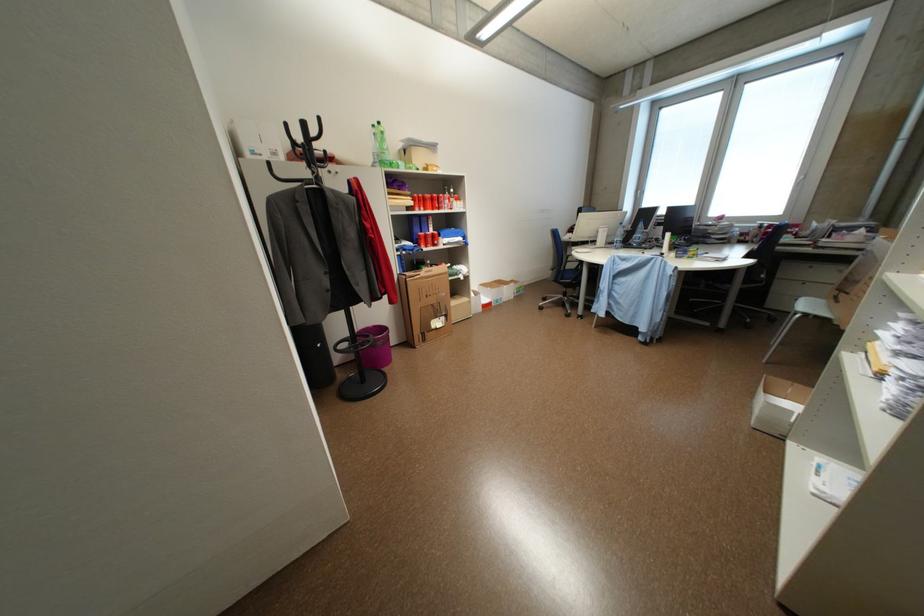
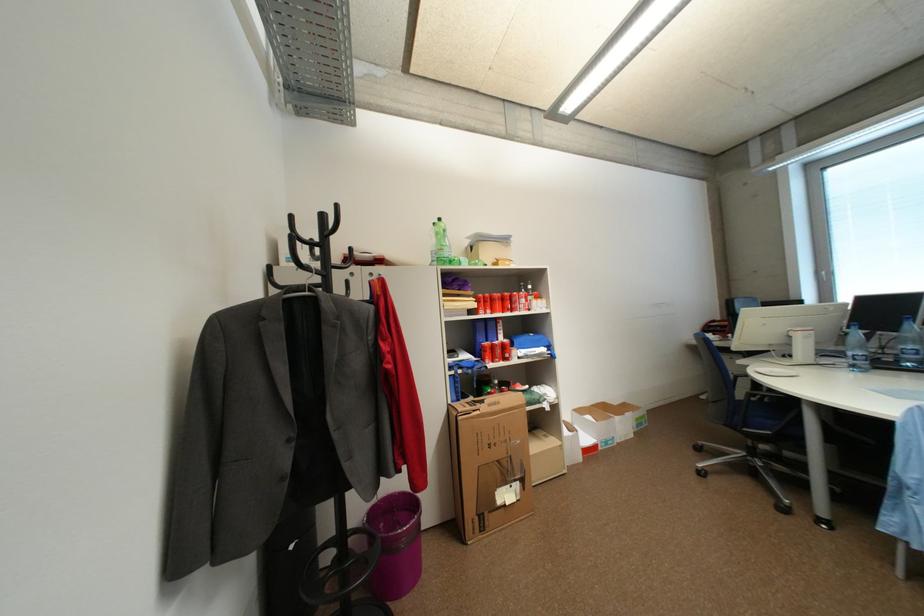
Find the pixel in the second image that matches the point at 432,341 in the first image.

(491, 529)